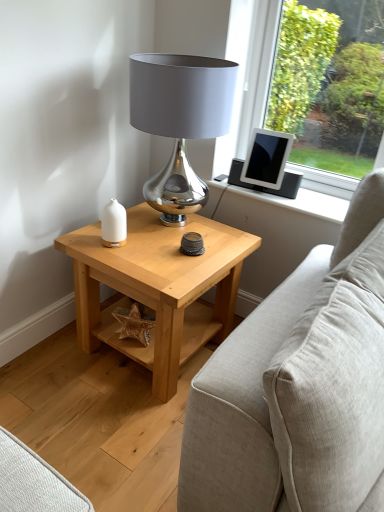
Locate an element on the screen. free space to the right of white matte candle holder at left is located at coordinates (147, 251).